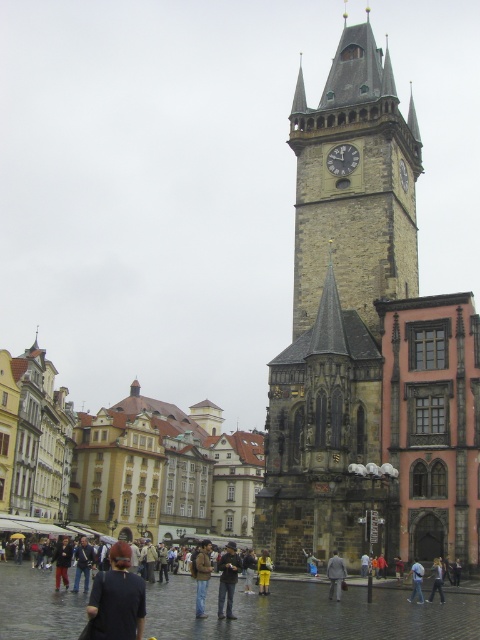
You are standing in the square and want to take a photo of both the stone clock tower at right and the stone gothic tower at center. Which tower should you position yourself closer to in order to include both in your frame?

You should position yourself closer to the stone gothic tower at center because the stone clock tower at right is further away, so moving closer to the closer tower allows both to be in the frame.

You are standing at the center of the square and want to take a photo of the stone clock tower at right. According to the scene description, where should you position yourself to capture the tower in the frame?

The stone clock tower at right is located at point (368, 344), so to capture it in the frame, you should position yourself facing the tower at that coordinate.